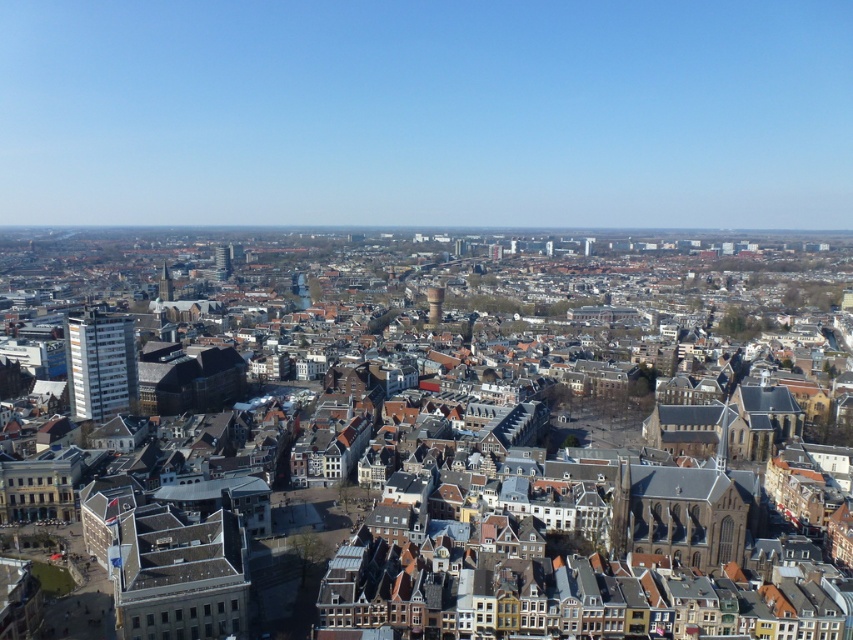
You are a drone operator tasked with delivering a package to the smooth concrete tower at center. Your drone can fly up to 700 feet. If you start from the white glossy building at left, will your drone have enough battery to reach the tower?

The white glossy building at left is 742.08 feet away from the smooth concrete tower at center. Since the drone can only fly up to 700 feet, it does not have enough battery to reach the tower from the white glossy building at left.

You are a drone operator flying over an urban area. Your drone is currently at the central square. You need to locate the white glossy building at left. Based on the coordinates provided, in which direction should you fly to reach it?

The white glossy building at left is located at coordinates point (x=100, y=364). Since you are at the central square, you should fly towards the left direction to reach it.